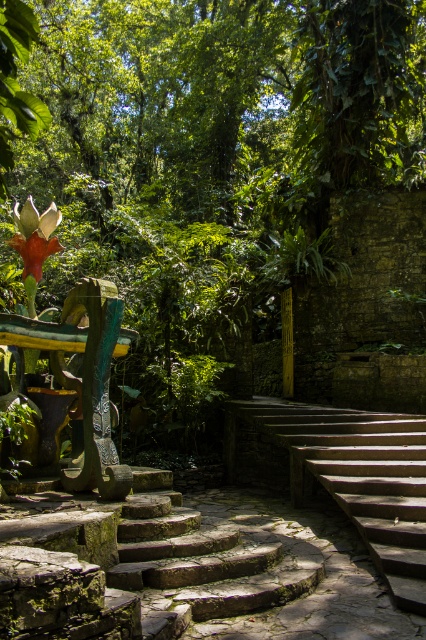
Question: Does green mossy stone stairs at center appear on the left side of stone textured stairs at center?

Choices:
 (A) yes
 (B) no

Answer: (A)

Question: Which of the following is the closest to the observer?

Choices:
 (A) (393, 560)
 (B) (167, 496)
 (C) (34, 221)

Answer: (A)

Question: Where is green mossy stone stairs at center located in relation to stone textured stairs at center in the image?

Choices:
 (A) right
 (B) left

Answer: (B)

Question: Which point is farther from the camera taking this photo?

Choices:
 (A) (49, 230)
 (B) (423, 612)

Answer: (A)

Question: Among these points, which one is farthest from the camera?

Choices:
 (A) (215, 605)
 (B) (253, 472)

Answer: (B)

Question: Can you confirm if stone textured stairs at center is positioned to the left of orange matte flower at left?

Choices:
 (A) no
 (B) yes

Answer: (A)